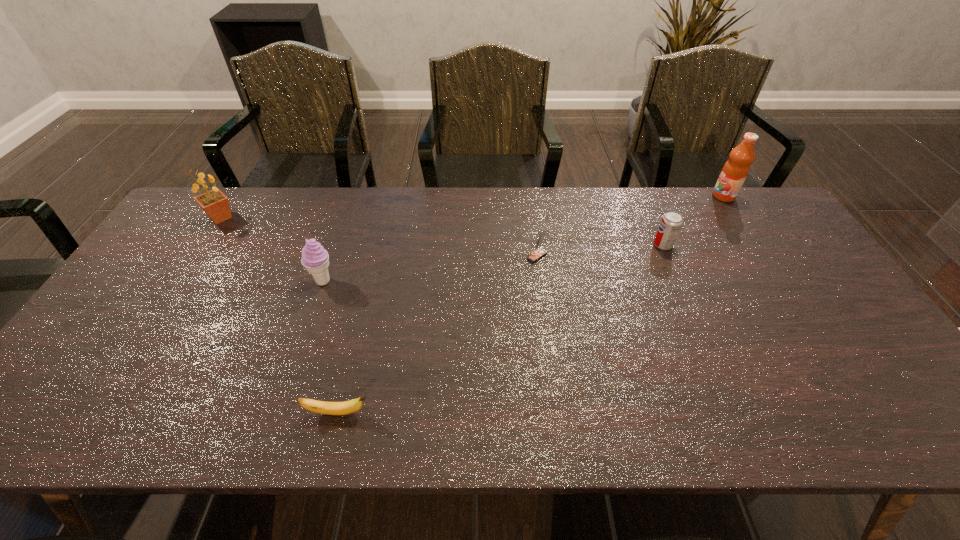
Where is `vacant space in between the fruit juice and the second tallest object`? vacant space in between the fruit juice and the second tallest object is located at coordinates (472, 207).

Identify the location of vacant area that lies between the shortest object and the fourth object from left to right. (437, 335).

This screenshot has width=960, height=540. What are the coordinates of `vacant space that is in between the third tallest object and the soda` in the screenshot? It's located at (493, 263).

This screenshot has height=540, width=960. Find the location of `object identified as the closest to the tallest object`. object identified as the closest to the tallest object is located at coordinates (671, 222).

Find the location of a particular element. Image resolution: width=960 pixels, height=540 pixels. the fourth closest object to the rightmost object is located at coordinates (347, 407).

At what (x,y) coordinates should I click in order to perform the action: click on free space in the image that satisfies the following two spatial constraints: 1. on the front side of the matchbox; 2. at the stem of the shortest object. Please return your answer as a coordinate pair (x, y). Looking at the image, I should click on (558, 413).

Where is `vacant region that satisfies the following two spatial constraints: 1. at the front of the sunflower with flowers visible; 2. on the back side of the fifth object from left to right`? This screenshot has width=960, height=540. vacant region that satisfies the following two spatial constraints: 1. at the front of the sunflower with flowers visible; 2. on the back side of the fifth object from left to right is located at coordinates (203, 245).

This screenshot has height=540, width=960. What are the coordinates of `vacant space that satisfies the following two spatial constraints: 1. at the front of the second farthest object with flowers visible; 2. on the back side of the third object from right to left` in the screenshot? It's located at (196, 256).

Where is `free space that satisfies the following two spatial constraints: 1. on the back side of the matchbox; 2. on the right side of the icecream`? This screenshot has height=540, width=960. free space that satisfies the following two spatial constraints: 1. on the back side of the matchbox; 2. on the right side of the icecream is located at coordinates (332, 256).

Where is `vacant space that satisfies the following two spatial constraints: 1. on the front label of the rightmost object; 2. on the front side of the icecream`? Image resolution: width=960 pixels, height=540 pixels. vacant space that satisfies the following two spatial constraints: 1. on the front label of the rightmost object; 2. on the front side of the icecream is located at coordinates (779, 281).